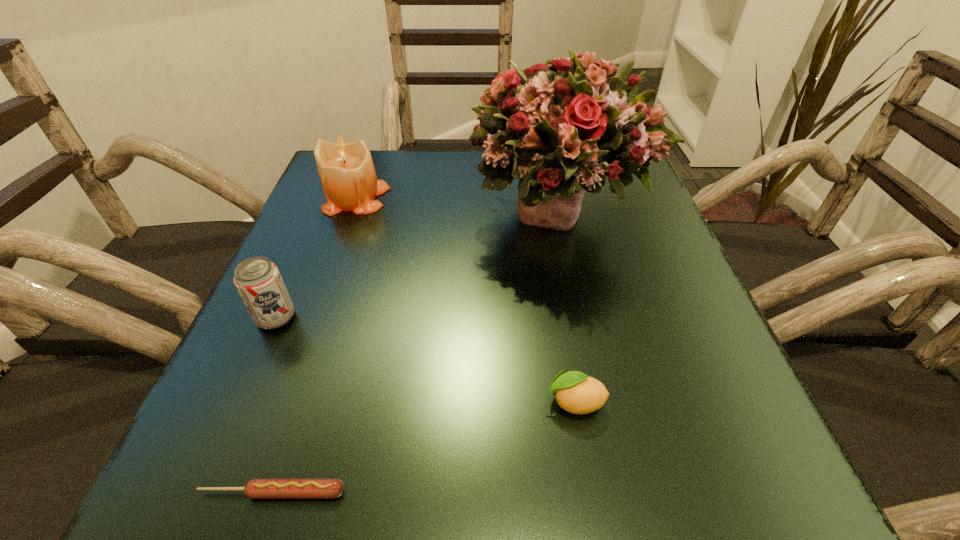
Locate an element on the screen. Image resolution: width=960 pixels, height=540 pixels. the tallest object is located at coordinates (563, 127).

Where is `the second tallest object`? the second tallest object is located at coordinates (347, 175).

The height and width of the screenshot is (540, 960). In order to click on the third nearest object in this screenshot , I will do `click(258, 281)`.

Identify the location of the third shortest object. (258, 281).

At what (x,y) coordinates should I click in order to perform the action: click on lemon. Please return your answer as a coordinate pair (x, y). This screenshot has width=960, height=540. Looking at the image, I should click on (575, 392).

You are a GUI agent. You are given a task and a screenshot of the screen. Output one action in this format:
    pyautogui.click(x=<x>, y=<y>)
    Task: Click on the second shortest object
    The height and width of the screenshot is (540, 960).
    Given the screenshot: What is the action you would take?
    pyautogui.click(x=575, y=392)

The width and height of the screenshot is (960, 540). Find the location of `the nearest object`. the nearest object is located at coordinates (256, 488).

The width and height of the screenshot is (960, 540). I want to click on sausage, so click(x=256, y=488).

I want to click on free region located on the back of the tallest object, so click(546, 154).

Locate an element on the screen. free region located 0.090m on the right of the fourth shortest object is located at coordinates (430, 198).